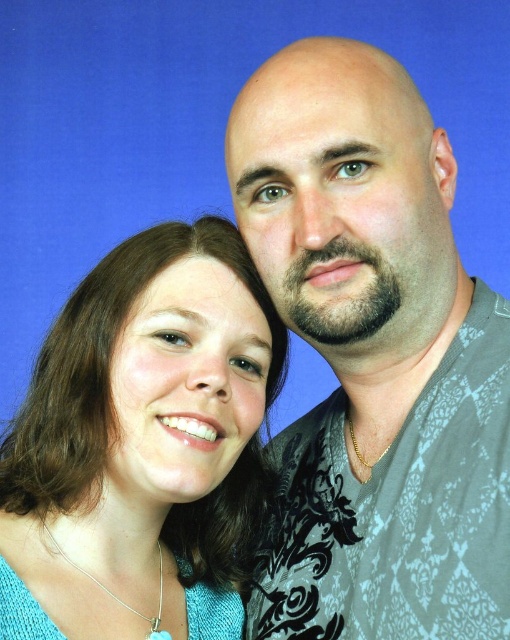
Image resolution: width=510 pixels, height=640 pixels. Describe the element at coordinates (373, 358) in the screenshot. I see `gray printed shirt at upper right` at that location.

Who is positioned more to the left, gray printed shirt at upper right or blue matte backdrop at upper center?

blue matte backdrop at upper center is more to the left.

Where is `gray printed shirt at upper right`? gray printed shirt at upper right is located at coordinates (373, 358).

Locate an element on the screen. The height and width of the screenshot is (640, 510). gray printed shirt at upper right is located at coordinates (373, 358).

Which of these two, blue matte backdrop at upper center or matte teal sweater at center, stands shorter?

matte teal sweater at center is shorter.

This screenshot has height=640, width=510. What do you see at coordinates (201, 125) in the screenshot?
I see `blue matte backdrop at upper center` at bounding box center [201, 125].

At what (x,y) coordinates should I click in order to perform the action: click on blue matte backdrop at upper center. Please return your answer as a coordinate pair (x, y). This screenshot has height=640, width=510. Looking at the image, I should click on (201, 125).

Identify the location of blue matte backdrop at upper center. (201, 125).

Who is positioned more to the right, gray printed shirt at upper right or matte teal sweater at center?

Result: gray printed shirt at upper right is more to the right.

Does point (415, 580) lie in front of point (73, 556)?

Yes, it is.

Between point (330, 305) and point (88, 316), which one is positioned in front?

Point (330, 305) is more forward.

The height and width of the screenshot is (640, 510). What are the coordinates of `gray printed shirt at upper right` in the screenshot? It's located at (373, 358).